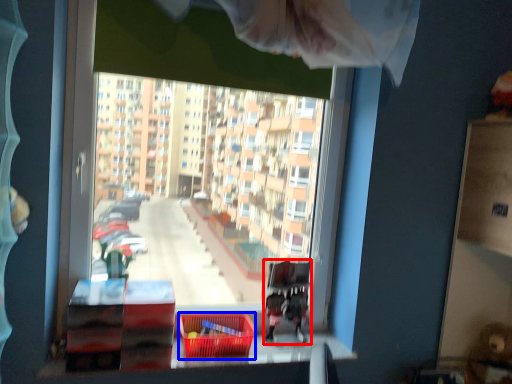
Question: Which point is closer to the camera, bunk bed (highlighted by a red box) or basket (highlighted by a blue box)?

Choices:
 (A) bunk bed
 (B) basket

Answer: (B)